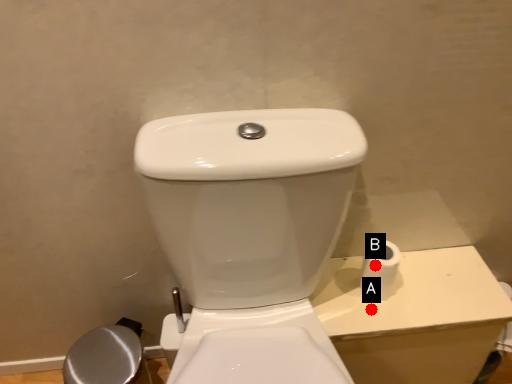
Question: Two points are circled on the image, labeled by A and B beside each circle. Among these points, which one is nearest to the camera?

Choices:
 (A) A is closer
 (B) B is closer

Answer: (B)